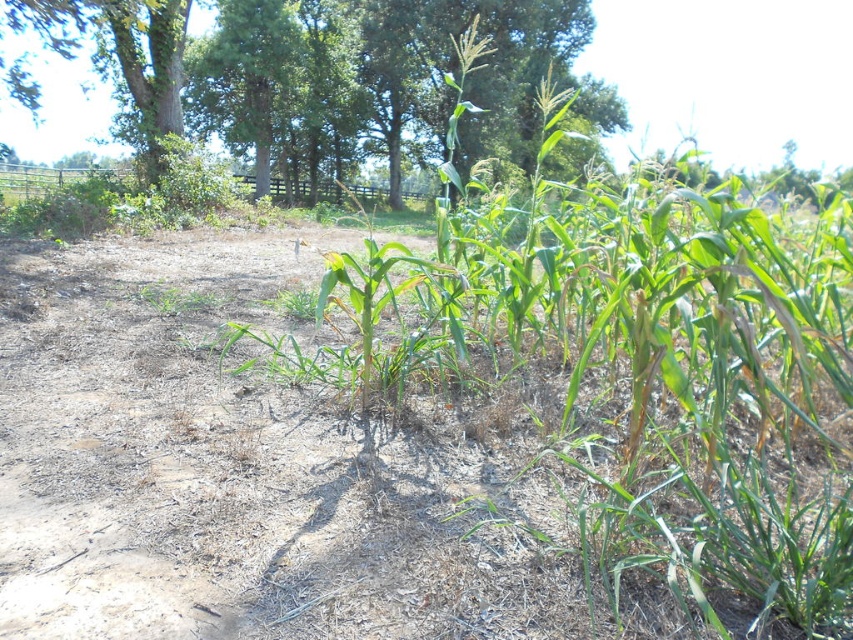
Question: Which of the following is the farthest from the observer?

Choices:
 (A) (524, 349)
 (B) (444, 56)

Answer: (B)

Question: Which object is closer to the camera taking this photo?

Choices:
 (A) green leafy corn at center
 (B) green leafy tree at upper center

Answer: (A)

Question: Is green leafy corn at center smaller than green leafy tree at upper center?

Choices:
 (A) no
 (B) yes

Answer: (B)

Question: Can you confirm if green leafy corn at center is smaller than green leafy tree at upper center?

Choices:
 (A) no
 (B) yes

Answer: (B)

Question: Is green leafy corn at center thinner than green leafy tree at upper center?

Choices:
 (A) no
 (B) yes

Answer: (B)